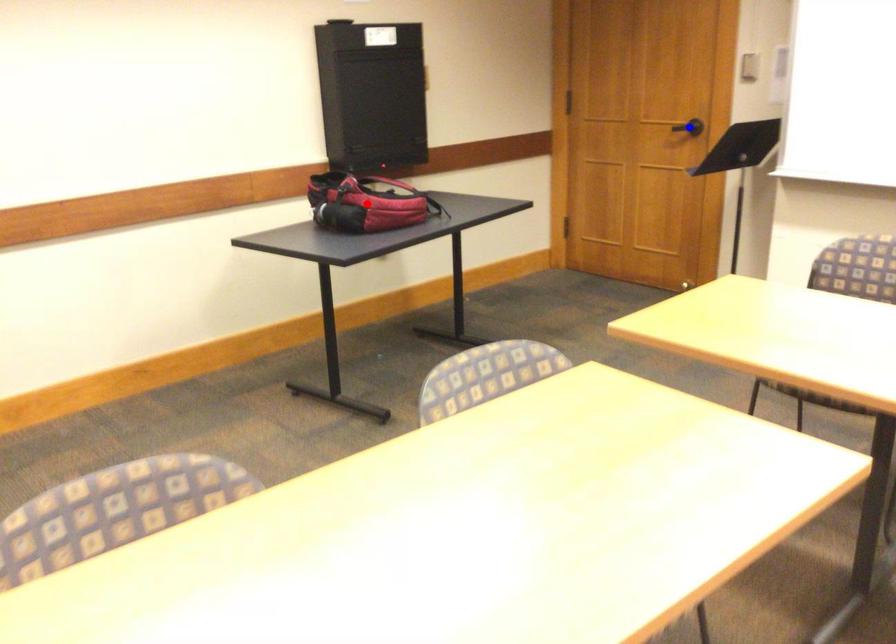
Question: In the image, two points are highlighted. Which point is nearer to the camera? Reply with the corresponding letter.

Choices:
 (A) blue point
 (B) red point

Answer: (B)